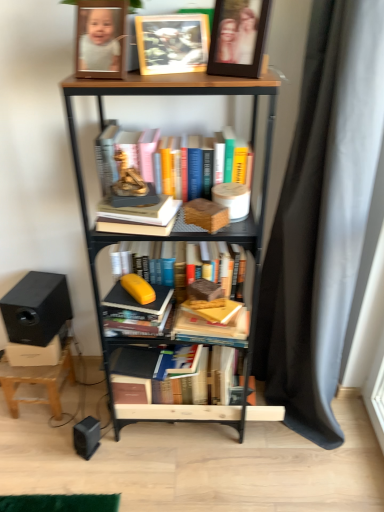
Identify the location of vacant area that is situated to the right of wooden stool at lower left. This screenshot has height=512, width=384. (96, 404).